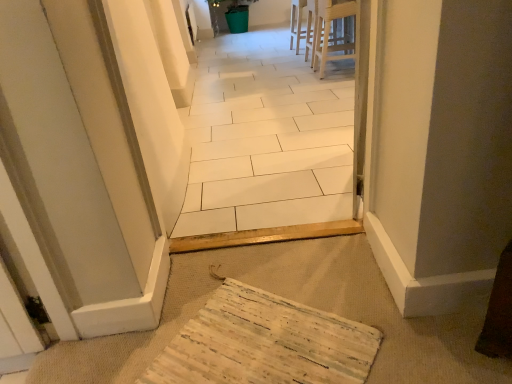
Describe the element at coordinates (298, 23) in the screenshot. I see `white wood chair at upper center` at that location.

Locate an element on the screen. white wood chair at upper center is located at coordinates (298, 23).

Where is `white wood chair at upper center`? white wood chair at upper center is located at coordinates (298, 23).

How different are the orientations of light wood stool at upper center and wooden textured mat at lower center in degrees?

The angle between the facing direction of light wood stool at upper center and the facing direction of wooden textured mat at lower center is 37.3 degrees.

Does light wood stool at upper center have a lesser height compared to wooden textured mat at lower center?

No.

Which is nearer, (328,0) or (277,340)?

Positioned in front is point (277,340).

Is light wood stool at upper center positioned with its back to wooden textured mat at lower center?

No.

In the image, is white wood chair at upper center on the left side or the right side of wooden textured mat at lower center?

In the image, white wood chair at upper center appears on the right side of wooden textured mat at lower center.

Could you tell me if white wood chair at upper center is turned towards wooden textured mat at lower center?

No, white wood chair at upper center does not turn towards wooden textured mat at lower center.

Is white wood chair at upper center in contact with wooden textured mat at lower center?

white wood chair at upper center and wooden textured mat at lower center are clearly separated.

Does point (297, 34) come behind point (246, 354)?

Yes, point (297, 34) is farther from viewer.

You are a GUI agent. You are given a task and a screenshot of the screen. Output one action in this format:
    pyautogui.click(x=<x>, y=<y>)
    Task: Click on the path that appears behind the wooden textured mat at lower center
    Image resolution: width=512 pixels, height=384 pixels.
    Given the screenshot: What is the action you would take?
    pyautogui.click(x=266, y=138)

From their relative heights in the image, would you say white tile floor at center is taller or shorter than wooden textured mat at lower center?

In the image, white tile floor at center appears to be taller than wooden textured mat at lower center.

Which is closer to the camera, (316, 121) or (317, 354)?

Point (316, 121).

Are white tile floor at center and wooden textured mat at lower center far apart?

Yes.

Would you say white wood chair at upper center is inside or outside light wood stool at upper center?

white wood chair at upper center is spatially situated outside light wood stool at upper center.

In the image, there is a light wood stool at upper center. Identify the location of chair below it (from a real-world perspective). This screenshot has height=384, width=512. (298, 23).

Considering their positions, is white wood chair at upper center located in front of or behind light wood stool at upper center?

Clearly, white wood chair at upper center is behind light wood stool at upper center.

Is white wood chair at upper center facing away from light wood stool at upper center?

white wood chair at upper center does not have its back to light wood stool at upper center.

From a real-world perspective, is wooden textured mat at lower center below white tile floor at center?

Correct, in the physical world, wooden textured mat at lower center is lower than white tile floor at center.

Does point (281, 358) lie in front of point (201, 96)?

Yes, it is in front of point (201, 96).

Between wooden textured mat at lower center and white tile floor at center, which one is positioned in front?

wooden textured mat at lower center.

This screenshot has width=512, height=384. What are the coordinates of `path on the left side of wooden textured mat at lower center` in the screenshot? It's located at (266, 138).

Which point is more forward, (323,40) or (231,62)?

Positioned in front is point (323,40).

Considering the sizes of objects light wood stool at upper center and white tile floor at center in the image provided, who is wider, light wood stool at upper center or white tile floor at center?

With larger width is light wood stool at upper center.

Can you tell me how much light wood stool at upper center and white tile floor at center differ in facing direction?

88.8 degrees separate the facing orientations of light wood stool at upper center and white tile floor at center.

Is light wood stool at upper center next to white tile floor at center?

light wood stool at upper center is not next to white tile floor at center, and they're not touching.

Which of these two, light wood stool at upper center or white wood chair at upper center, is bigger?

Bigger between the two is light wood stool at upper center.

Where is `chair behind the light wood stool at upper center`? The image size is (512, 384). chair behind the light wood stool at upper center is located at coordinates pyautogui.click(x=298, y=23).

How far apart are light wood stool at upper center and white wood chair at upper center?

light wood stool at upper center and white wood chair at upper center are 19.85 inches apart.

Considering the positions of objects light wood stool at upper center and white wood chair at upper center in the image provided, who is behind, light wood stool at upper center or white wood chair at upper center?

Positioned behind is white wood chair at upper center.

You are a GUI agent. You are given a task and a screenshot of the screen. Output one action in this format:
    pyautogui.click(x=<x>, y=<y>)
    Task: Click on the furniture above the wooden textured mat at lower center (from a real-world perspective)
    This screenshot has width=512, height=384.
    Given the screenshot: What is the action you would take?
    pyautogui.click(x=330, y=30)

The height and width of the screenshot is (384, 512). Find the location of `cardboard that is in front of the white wood chair at upper center`. cardboard that is in front of the white wood chair at upper center is located at coordinates (264, 343).

Looking at the image, which one is located further to white wood chair at upper center, light wood stool at upper center or wooden textured mat at lower center?

Based on the image, wooden textured mat at lower center appears to be further to white wood chair at upper center.

Considering their positions, is light wood stool at upper center positioned closer to white tile floor at center than wooden textured mat at lower center?

light wood stool at upper center is positioned closer to the anchor white tile floor at center.

Estimate the real-world distances between objects in this image. Which object is closer to white tile floor at center, light wood stool at upper center or white wood chair at upper center?

The object closer to white tile floor at center is light wood stool at upper center.

In the scene shown: Looking at the image, which one is located closer to wooden textured mat at lower center, white wood chair at upper center or light wood stool at upper center?

light wood stool at upper center.

Looking at this image, considering their positions, is light wood stool at upper center positioned closer to wooden textured mat at lower center than white tile floor at center?

The object closer to wooden textured mat at lower center is white tile floor at center.

Looking at the image, which one is located further to white wood chair at upper center, white tile floor at center or light wood stool at upper center?

white tile floor at center is further to white wood chair at upper center.

Consider the image. Which object lies nearer to the anchor point white tile floor at center, white wood chair at upper center or light wood stool at upper center?

Based on the image, light wood stool at upper center appears to be nearer to white tile floor at center.

Which object lies nearer to the anchor point light wood stool at upper center, white wood chair at upper center or wooden textured mat at lower center?

Based on the image, white wood chair at upper center appears to be nearer to light wood stool at upper center.

Where is `furniture between white tile floor at center and white wood chair at upper center along the z-axis`? Image resolution: width=512 pixels, height=384 pixels. furniture between white tile floor at center and white wood chair at upper center along the z-axis is located at coordinates (330, 30).

Find the location of `path positioned between wooden textured mat at lower center and light wood stool at upper center from near to far`. path positioned between wooden textured mat at lower center and light wood stool at upper center from near to far is located at coordinates (266, 138).

Locate an element on the screen. path between wooden textured mat at lower center and white wood chair at upper center along the z-axis is located at coordinates (266, 138).

Where is `furniture between wooden textured mat at lower center and white wood chair at upper center in the front-back direction`? furniture between wooden textured mat at lower center and white wood chair at upper center in the front-back direction is located at coordinates (330, 30).